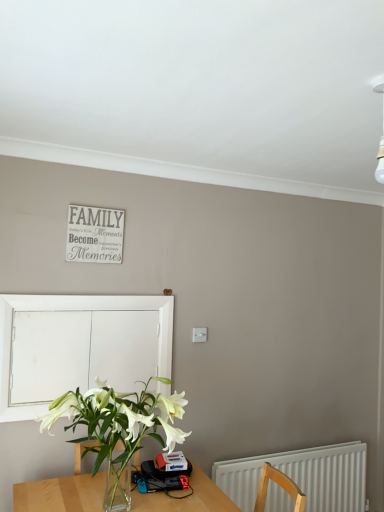
Question: Is white matte signboard at upper center in front of or behind white plastic radiator at lower right in the image?

Choices:
 (A) behind
 (B) front

Answer: (B)

Question: Based on their sizes in the image, would you say white matte signboard at upper center is bigger or smaller than white plastic radiator at lower right?

Choices:
 (A) small
 (B) big

Answer: (A)

Question: Which of these objects is positioned farthest from the white matte window screen at left?

Choices:
 (A) white matte signboard at upper center
 (B) white plastic radiator at lower right

Answer: (B)

Question: Estimate the real-world distances between objects in this image. Which object is closer to the white plastic radiator at lower right?

Choices:
 (A) white matte signboard at upper center
 (B) white matte window screen at left

Answer: (B)